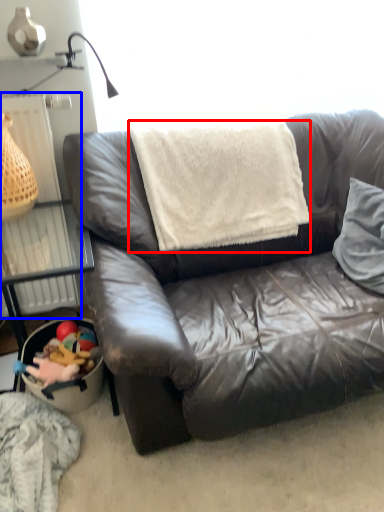
Question: Which of the following is the closest to the observer, blanket (highlighted by a red box) or radiator (highlighted by a blue box)?

Choices:
 (A) blanket
 (B) radiator

Answer: (A)